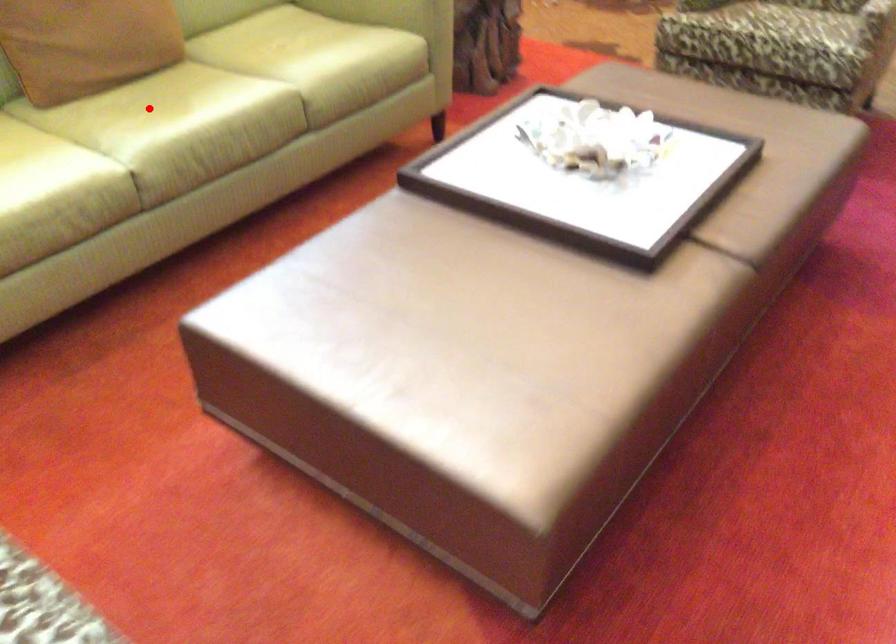
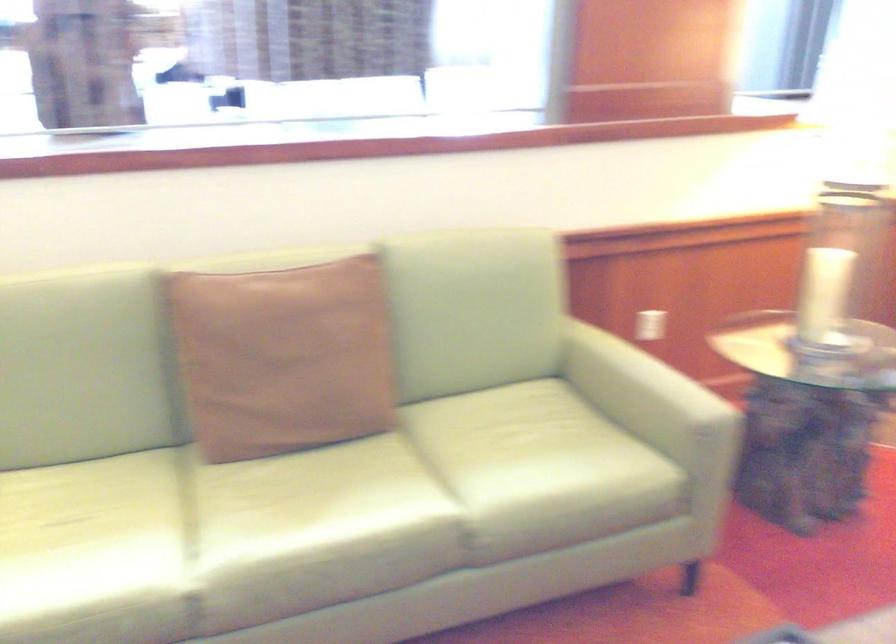
Question: I am providing you with two images of the same scene from different viewpoints. Given a red point in image1, look at the same physical point in image2. Is it:

Choices:
 (A) Closer to the viewpoint
 (B) Farther from the viewpoint

Answer: (A)